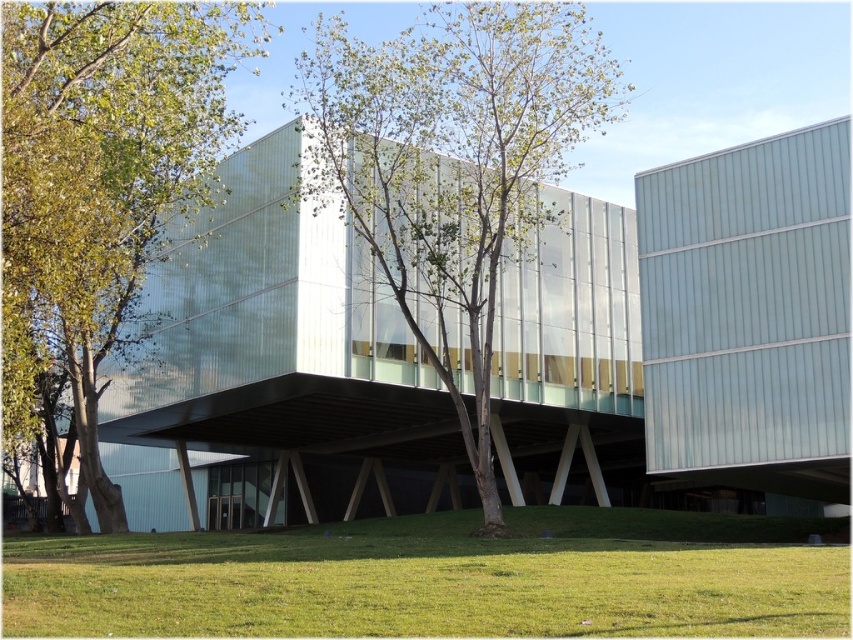
You are standing at the base of the green leafy tree at left and want to walk to the green leafy tree at center. Which direction should you walk to get there?

Result: The green leafy tree at center is shorter than the green leafy tree at left, so you should walk towards the shorter tree located in the center direction.

You are standing on the green grass at lower center looking up. Which direction should you face to see the green leafy tree at center?

Since the green grass at lower center is below the green leafy tree at center, you should look upward to see the green leafy tree at center.

You are standing on the green grass at lower center looking towards the building. Which direction should you walk to reach the green leafy tree at left?

You should walk upwards towards the green leafy tree at left since the green grass at lower center is below it.